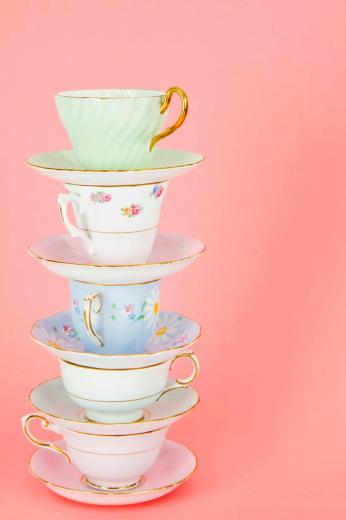
This screenshot has width=346, height=520. Identify the location of handle. (179, 122), (192, 376), (31, 438), (86, 315), (97, 308), (171, 388), (63, 215).